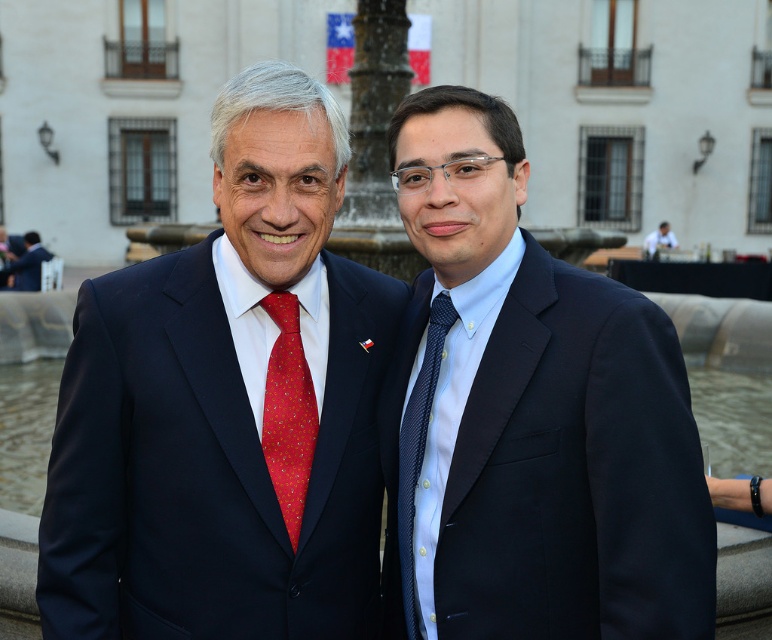
Between blue satin suit at center and red silk tie at center, which one is positioned lower?

red silk tie at center

Which of these two, blue satin suit at center or red silk tie at center, stands taller?

Standing taller between the two is blue satin suit at center.

The height and width of the screenshot is (640, 772). I want to click on blue satin suit at center, so click(x=530, y=417).

From the picture: Between blue satin suit at center and dark blue textured tie at center, which one appears on the right side from the viewer's perspective?

Positioned to the right is blue satin suit at center.

Can you confirm if blue satin suit at center is positioned to the left of dark blue textured tie at center?

Incorrect, blue satin suit at center is not on the left side of dark blue textured tie at center.

Find the location of a particular element. blue satin suit at center is located at coordinates click(x=530, y=417).

Can you confirm if blue satin suit at center is positioned to the right of navy blue suit at center?

Indeed, blue satin suit at center is positioned on the right side of navy blue suit at center.

Between point (513, 324) and point (219, 317), which one is positioned in front?

Point (513, 324)

Identify the location of blue satin suit at center. (530, 417).